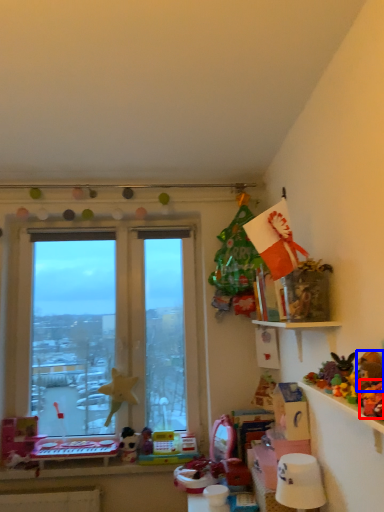
Question: Which object appears farthest to the camera in this image, toy (highlighted by a red box) or toy (highlighted by a blue box)?

Choices:
 (A) toy
 (B) toy

Answer: (B)